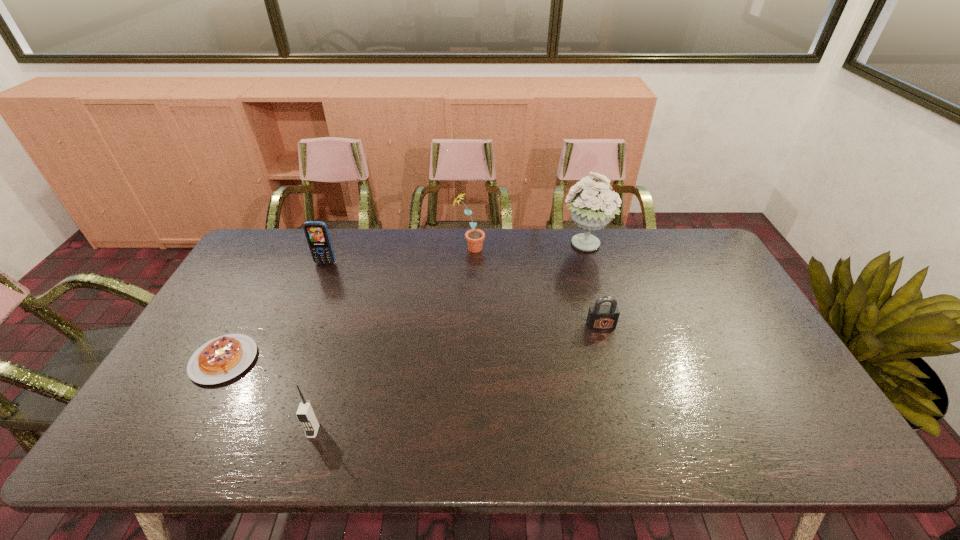
I want to click on object present at the left edge, so click(x=223, y=358).

This screenshot has height=540, width=960. Find the location of `vacant space at the far edge of the desktop`. vacant space at the far edge of the desktop is located at coordinates (375, 262).

Image resolution: width=960 pixels, height=540 pixels. Identify the location of free region at the near edge of the desktop. (348, 458).

Locate an element on the screen. Image resolution: width=960 pixels, height=540 pixels. blank space at the left edge of the desktop is located at coordinates (242, 276).

Locate an element on the screen. This screenshot has height=540, width=960. vacant region at the right edge is located at coordinates (772, 370).

At what (x,y) coordinates should I click in order to perform the action: click on empty space that is in between the third object from right to left and the bouquet. Please return your answer as a coordinate pair (x, y). This screenshot has height=540, width=960. Looking at the image, I should click on pos(527,247).

Where is `vacant point located between the third object from right to left and the left cellular telephone`? The height and width of the screenshot is (540, 960). vacant point located between the third object from right to left and the left cellular telephone is located at coordinates (397, 256).

Image resolution: width=960 pixels, height=540 pixels. What are the coordinates of `empty space that is in between the shortest object and the second shortest object` in the screenshot? It's located at (413, 343).

Locate an element on the screen. The height and width of the screenshot is (540, 960). free space between the second nearest object and the third nearest object is located at coordinates (413, 343).

Locate an element on the screen. free space that is in between the nearest object and the sunflower is located at coordinates (392, 340).